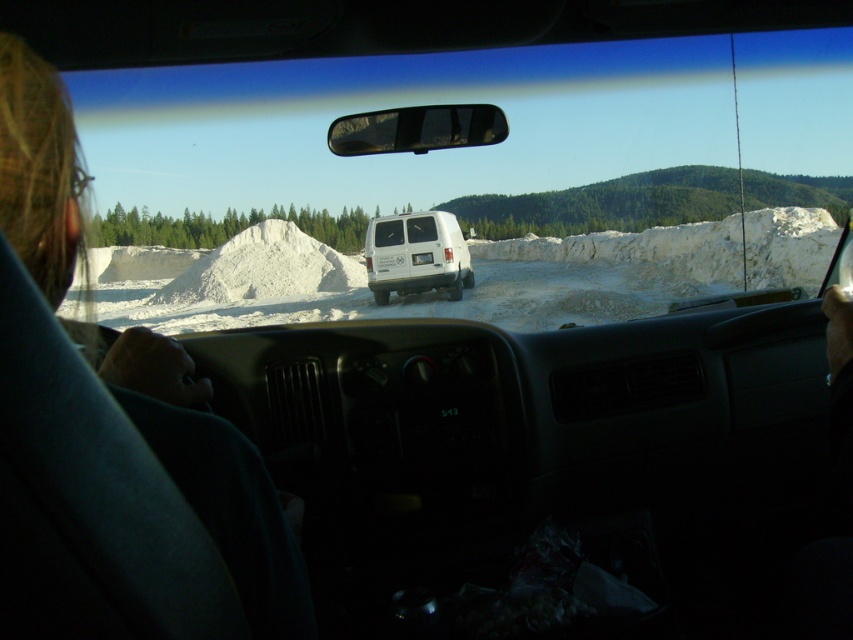
You are a passenger in the car and want to know which of the two points, point (709, 42) or point (323, 260), is closer to you. Based on the scene, which point is nearer?

Point (709, 42) is closer to the camera than point (323, 260), so it is nearer to you.

You are a passenger in a car and want to check the weather outside. You look through the transparent glass car window at center and see the white powdery mound at center. Which object allows you to see the snow outside?

The transparent glass car window at center allows you to see the snow outside because it is above the white powdery mound at center, which is the snow.